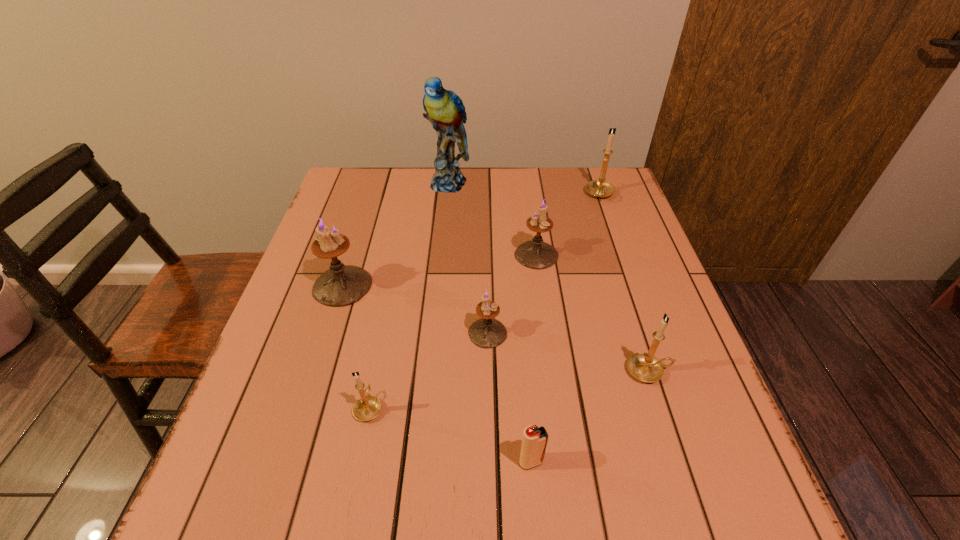
The width and height of the screenshot is (960, 540). In order to click on parrot in this screenshot , I will do `click(444, 109)`.

Locate an element on the screen. The image size is (960, 540). the third object from left to right is located at coordinates (444, 109).

Where is `the farthest candle holder`? the farthest candle holder is located at coordinates (599, 188).

You are a GUI agent. You are given a task and a screenshot of the screen. Output one action in this format:
    pyautogui.click(x=<x>, y=<y>)
    Task: Click on the farthest gold candle holder
    Image resolution: width=960 pixels, height=540 pixels.
    Given the screenshot: What is the action you would take?
    pyautogui.click(x=599, y=188)

I want to click on the leftmost candle holder, so click(x=342, y=285).

Where is `the biggest purple candle holder`? The width and height of the screenshot is (960, 540). the biggest purple candle holder is located at coordinates (342, 285).

Locate an element on the screen. The image size is (960, 540). the fourth candle holder from left to right is located at coordinates (536, 254).

Where is `the rightmost purple candle holder`? the rightmost purple candle holder is located at coordinates (536, 254).

Find the location of `the second nearest gold candle holder`. the second nearest gold candle holder is located at coordinates (645, 367).

In order to click on the second smallest gold candle holder in this screenshot , I will do `click(645, 367)`.